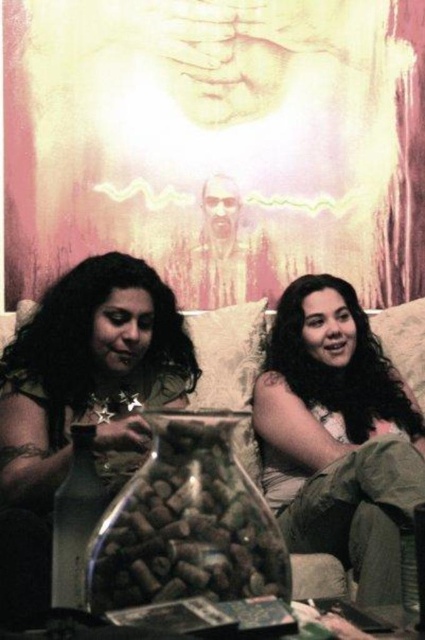
Question: Which of the following is the farthest from the observer?

Choices:
 (A) matte gold bracelet at left
 (B) matte beige hair at center

Answer: (B)

Question: Which point appears closest to the camera in this image?

Choices:
 (A) (25, 458)
 (B) (297, 404)

Answer: (A)

Question: Does matte beige hair at center appear over matte gold bracelet at left?

Choices:
 (A) no
 (B) yes

Answer: (A)

Question: Is matte beige hair at center to the right of matte gold bracelet at left from the viewer's perspective?

Choices:
 (A) no
 (B) yes

Answer: (B)

Question: Is matte beige hair at center in front of matte gold bracelet at left?

Choices:
 (A) yes
 (B) no

Answer: (B)